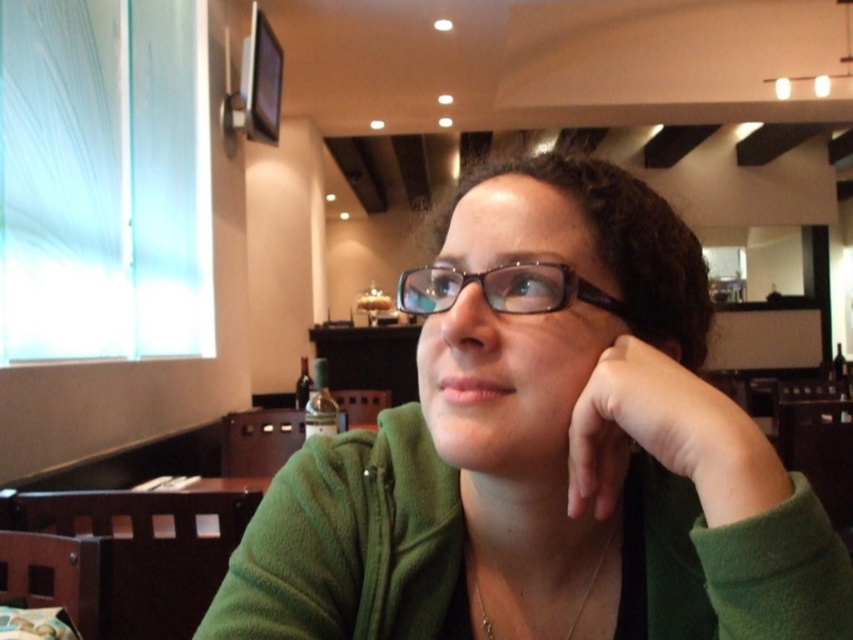
Which is more to the left, skinny flesh-colored hand at lower right or clear plastic glasses at center?

From the viewer's perspective, clear plastic glasses at center appears more on the left side.

Does skinny flesh-colored hand at lower right appear over clear plastic glasses at center?

Incorrect, skinny flesh-colored hand at lower right is not positioned above clear plastic glasses at center.

Who is more distant from viewer, (589,426) or (515,296)?

The point (515,296) is more distant.

At what (x,y) coordinates should I click in order to perform the action: click on skinny flesh-colored hand at lower right. Please return your answer as a coordinate pair (x, y). The image size is (853, 640). Looking at the image, I should click on (668, 433).

Does point (583, 273) lie in front of point (587, 298)?

No, it is not.

Can you confirm if green fleece jacket at center is smaller than clear plastic glasses at center?

Actually, green fleece jacket at center might be larger than clear plastic glasses at center.

Is point (508, 465) behind point (537, 300)?

Yes, point (508, 465) is behind point (537, 300).

Find the location of a particular element. This screenshot has height=640, width=853. green fleece jacket at center is located at coordinates (544, 451).

Looking at this image, does green fleece jacket at center appear over skinny flesh-colored hand at lower right?

No.

Based on the photo, does green fleece jacket at center appear under skinny flesh-colored hand at lower right?

Yes, green fleece jacket at center is below skinny flesh-colored hand at lower right.

What do you see at coordinates (544, 451) in the screenshot?
I see `green fleece jacket at center` at bounding box center [544, 451].

I want to click on green fleece jacket at center, so click(x=544, y=451).